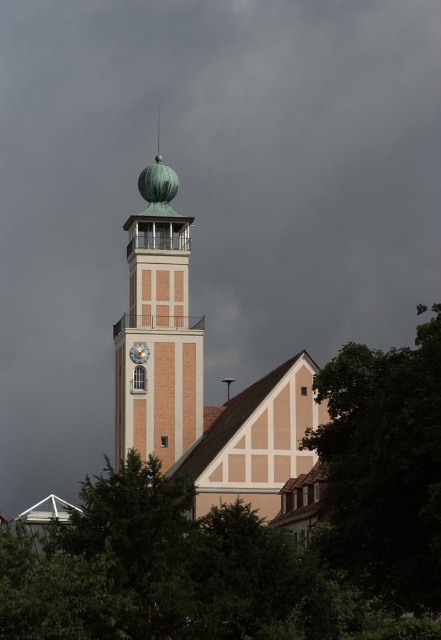
Question: Does beige wooden church at center appear on the right side of gold metallic clock at center?

Choices:
 (A) yes
 (B) no

Answer: (A)

Question: Is the position of beige wooden church at center less distant than that of gold metallic clock at center?

Choices:
 (A) no
 (B) yes

Answer: (B)

Question: Among these objects, which one is farthest from the camera?

Choices:
 (A) gold metallic clock at center
 (B) beige wooden church at center
 (C) green leafy tree at lower right

Answer: (A)

Question: Considering the relative positions of metallic dome at center and gold metallic clock at center in the image provided, where is metallic dome at center located with respect to gold metallic clock at center?

Choices:
 (A) above
 (B) below

Answer: (A)

Question: Among these objects, which one is nearest to the camera?

Choices:
 (A) beige wooden church at center
 (B) gold metallic clock at center
 (C) green leafy tree at lower right
 (D) metallic dome at center

Answer: (C)

Question: Among these objects, which one is farthest from the camera?

Choices:
 (A) metallic dome at center
 (B) green leafy tree at lower right
 (C) beige wooden church at center
 (D) gold metallic clock at center

Answer: (D)